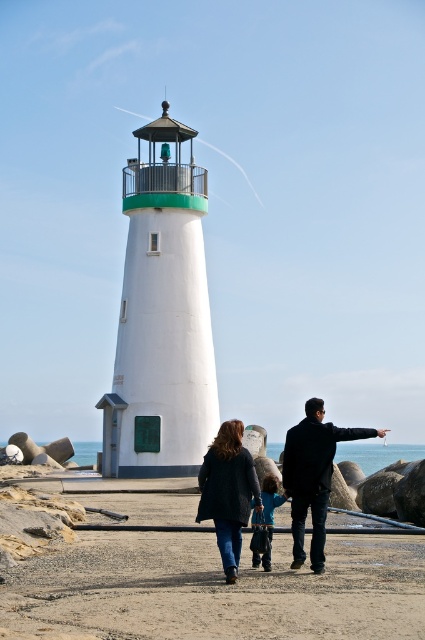
You are a photographer planning to capture a photo of the smooth sand at lower center and the blue fleece jacket at center. Based on their sizes, which object should you focus on to ensure both are clearly visible in the frame?

The smooth sand at lower center is bigger than the blue fleece jacket at center, so focusing on the smooth sand at lower center would ensure both objects are clearly visible in the frame.

You are a photographer standing at the scene. You want to take a photo of the two people wearing the dark blue coat at center and blue fleece jacket at center. The minimum distance your camera can focus is 1.5 meters. Can you capture both subjects clearly in the same photo without moving the camera?

The dark blue coat at center is 1.84 meters from the blue fleece jacket at center. Since the minimum focus distance of the camera is 1.5 meters, the subjects are within the required distance, so yes, you can capture both clearly in the same photo without moving the camera.

You are standing at the edge of the beach and want to walk towards the lighthouse. There is smooth sand at lower center and a blue fleece jacket at center in your path. Which path has a wider area to walk through?

The smooth sand at lower center has a wider area to walk through since its width is larger than the blue fleece jacket at center.